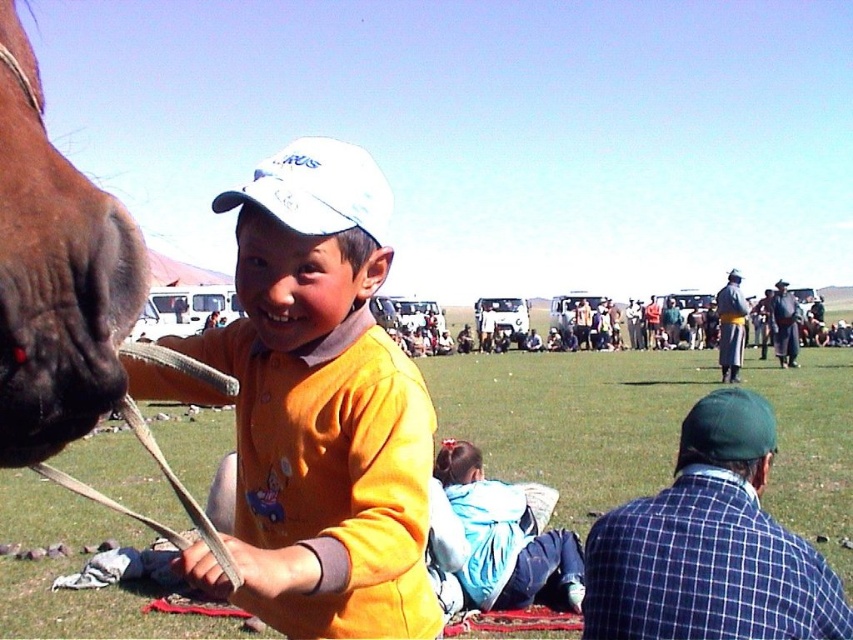
Can you confirm if green plaid shirt at lower right is wider than light blue fabric at lower center?

Incorrect, green plaid shirt at lower right's width does not surpass light blue fabric at lower center's.

Does green plaid shirt at lower right appear on the left side of light blue fabric at lower center?

In fact, green plaid shirt at lower right is to the right of light blue fabric at lower center.

Identify the location of green plaid shirt at lower right. (711, 545).

Where is `green plaid shirt at lower right`? green plaid shirt at lower right is located at coordinates (711, 545).

Can you confirm if yellow matte shirt at center is positioned to the right of brown glossy horse at left?

Yes, yellow matte shirt at center is to the right of brown glossy horse at left.

The width and height of the screenshot is (853, 640). What do you see at coordinates (320, 408) in the screenshot?
I see `yellow matte shirt at center` at bounding box center [320, 408].

The image size is (853, 640). I want to click on yellow matte shirt at center, so click(x=320, y=408).

Does point (13, 3) come closer to viewer compared to point (553, 556)?

Yes.

Which is behind, point (10, 125) or point (485, 540)?

Point (485, 540)

Where is `brown glossy horse at left`? brown glossy horse at left is located at coordinates (55, 275).